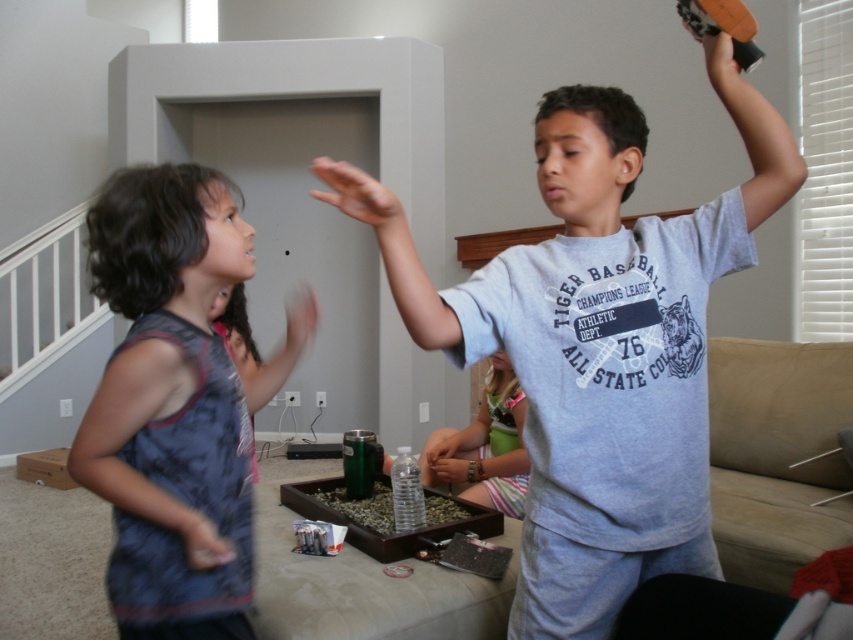
Between gray cotton shirt at center and dark blue sleeveless shirt at left, which one has less height?

With less height is dark blue sleeveless shirt at left.

Is gray cotton shirt at center shorter than dark blue sleeveless shirt at left?

No, gray cotton shirt at center is not shorter than dark blue sleeveless shirt at left.

I want to click on gray cotton shirt at center, so pos(598,342).

The width and height of the screenshot is (853, 640). I want to click on gray cotton shirt at center, so click(x=598, y=342).

Does gray cotton shirt at center appear on the left side of striped fabric pants at center?

No, gray cotton shirt at center is not to the left of striped fabric pants at center.

Looking at this image, measure the distance between gray cotton shirt at center and camera.

gray cotton shirt at center and camera are 3.49 feet apart.

The height and width of the screenshot is (640, 853). I want to click on gray cotton shirt at center, so click(x=598, y=342).

Which is more to the left, dark blue sleeveless shirt at left or striped fabric pants at center?

dark blue sleeveless shirt at left

Between dark blue sleeveless shirt at left and striped fabric pants at center, which one has less height?

Standing shorter between the two is striped fabric pants at center.

Is point (102, 280) farther from camera compared to point (525, 467)?

No.

Find the location of `dark blue sleeveless shirt at left`. dark blue sleeveless shirt at left is located at coordinates (173, 403).